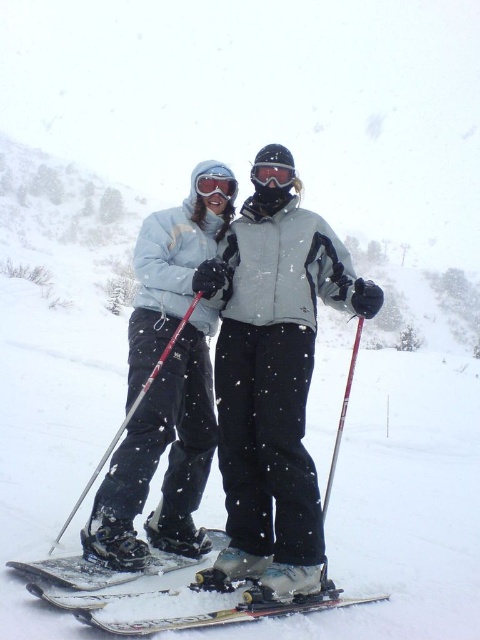
Question: Can you confirm if white matte skis at center is smaller than glossy plastic goggles at center?

Choices:
 (A) no
 (B) yes

Answer: (A)

Question: Which point is farther from the camera taking this photo?

Choices:
 (A) (55, 572)
 (B) (236, 465)

Answer: (B)

Question: Observing the image, what is the correct spatial positioning of white matte skis at center in reference to glossy plastic goggles at center?

Choices:
 (A) right
 (B) left

Answer: (B)

Question: Among these points, which one is farthest from the camera?

Choices:
 (A) (334, 593)
 (B) (222, 182)
 (C) (21, 566)

Answer: (B)

Question: Which point is farther to the camera?

Choices:
 (A) (165, 556)
 (B) (260, 179)
 (C) (170, 342)

Answer: (B)

Question: Is white matte skis at center thinner than metallic skis at center?

Choices:
 (A) no
 (B) yes

Answer: (A)